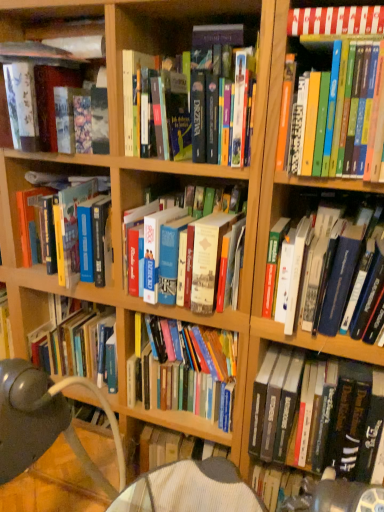
Question: Which direction should I rotate to look at hardcover book at center, which is the eighth book in top-to-bottom order, — up or down?

Choices:
 (A) up
 (B) down

Answer: (B)

Question: Can we say matte black book at upper left, which is counted as the 2th book, starting from the top, lies outside hardcover book at center, which is the eighth book in top-to-bottom order?

Choices:
 (A) yes
 (B) no

Answer: (A)

Question: From a real-world perspective, is matte black book at upper left, which ranks as the 8th book in bottom-to-top order, under hardcover book at center, which is the eighth book in top-to-bottom order?

Choices:
 (A) yes
 (B) no

Answer: (B)

Question: Does matte black book at upper left, which ranks as the 8th book in bottom-to-top order, have a smaller size compared to hardcover book at center, which is the eighth book in top-to-bottom order?

Choices:
 (A) no
 (B) yes

Answer: (B)

Question: Is matte black book at upper left, which is counted as the 2th book, starting from the top, thinner than hardcover book at center, which is the eighth book in top-to-bottom order?

Choices:
 (A) yes
 (B) no

Answer: (B)

Question: Is hardcover book at center, which is the eighth book in top-to-bottom order, a part of matte black book at upper left, which is counted as the 2th book, starting from the top?

Choices:
 (A) no
 (B) yes

Answer: (A)

Question: Is matte black book at upper left, which ranks as the 8th book in bottom-to-top order, wider than hardcover book at center, which is the eighth book in top-to-bottom order?

Choices:
 (A) no
 (B) yes

Answer: (B)

Question: Considering the relative sizes of hardcover book at center, which is the eighth book in top-to-bottom order, and hardcover books at center, which ranks as the fourth book in bottom-to-top order, in the image provided, is hardcover book at center, which is the eighth book in top-to-bottom order, shorter than hardcover books at center, which ranks as the fourth book in bottom-to-top order,?

Choices:
 (A) yes
 (B) no

Answer: (B)

Question: Are hardcover book at center, the 2th book positioned from the bottom, and hardcover books at center, the 6th book viewed from the top, located far from each other?

Choices:
 (A) yes
 (B) no

Answer: (B)

Question: Considering the relative sizes of hardcover book at center, the 2th book positioned from the bottom, and hardcover books at center, which ranks as the fourth book in bottom-to-top order, in the image provided, is hardcover book at center, the 2th book positioned from the bottom, thinner than hardcover books at center, which ranks as the fourth book in bottom-to-top order,?

Choices:
 (A) yes
 (B) no

Answer: (A)

Question: Can you confirm if hardcover book at center, which is the eighth book in top-to-bottom order, is bigger than hardcover books at center, which ranks as the fourth book in bottom-to-top order?

Choices:
 (A) yes
 (B) no

Answer: (B)

Question: Considering the relative positions of hardcover book at center, the 2th book positioned from the bottom, and hardcover books at center, which ranks as the fourth book in bottom-to-top order, in the image provided, is hardcover book at center, the 2th book positioned from the bottom, to the right of hardcover books at center, which ranks as the fourth book in bottom-to-top order, from the viewer's perspective?

Choices:
 (A) yes
 (B) no

Answer: (B)

Question: From a real-world perspective, is hardcover book at center, which is the eighth book in top-to-bottom order, on top of hardcover books at center, which ranks as the fourth book in bottom-to-top order?

Choices:
 (A) no
 (B) yes

Answer: (A)

Question: Is hardcover books at upper right, acting as the fourth book starting from the top, facing away from hardcover book at center, marked as the 3th book in a top-to-bottom arrangement?

Choices:
 (A) no
 (B) yes

Answer: (A)